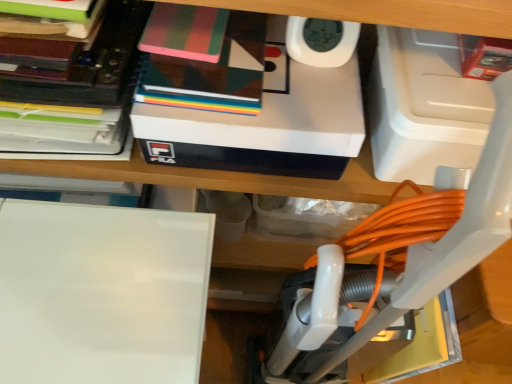
Image resolution: width=512 pixels, height=384 pixels. Identify the location of empty space that is ontop of white matte box at upper center. (275, 77).